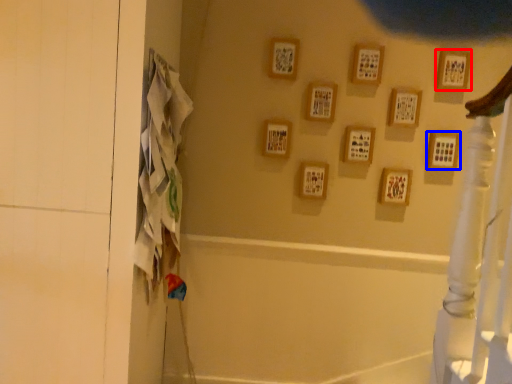
Question: Which object appears closest to the camera in this image, picture frame (highlighted by a red box) or picture frame (highlighted by a blue box)?

Choices:
 (A) picture frame
 (B) picture frame

Answer: (A)